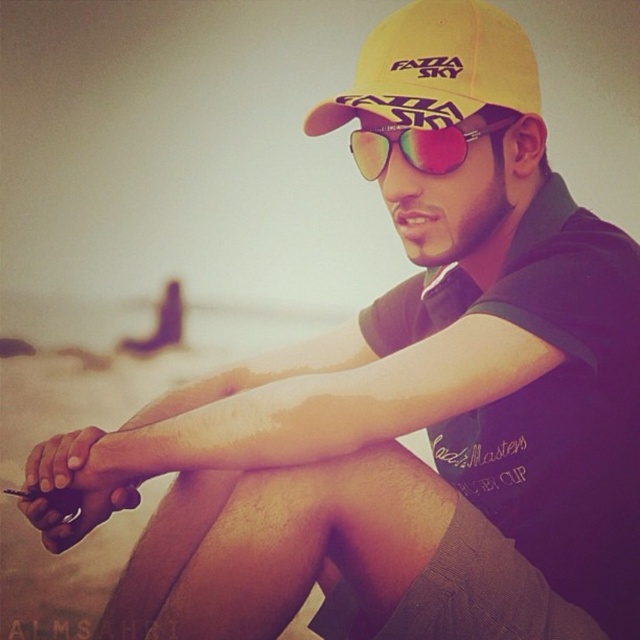
Question: Is yellow fabric baseball cap at upper center wider than multicolored reflective sunglasses at center?

Choices:
 (A) no
 (B) yes

Answer: (B)

Question: Is yellow fabric baseball cap at upper center above multicolored reflective sunglasses at center?

Choices:
 (A) no
 (B) yes

Answer: (B)

Question: Where is yellow fabric baseball cap at upper center located in relation to multicolored reflective sunglasses at center in the image?

Choices:
 (A) below
 (B) above

Answer: (B)

Question: Which object is farther from the camera taking this photo?

Choices:
 (A) multicolored reflective sunglasses at center
 (B) yellow fabric baseball cap at upper center

Answer: (A)